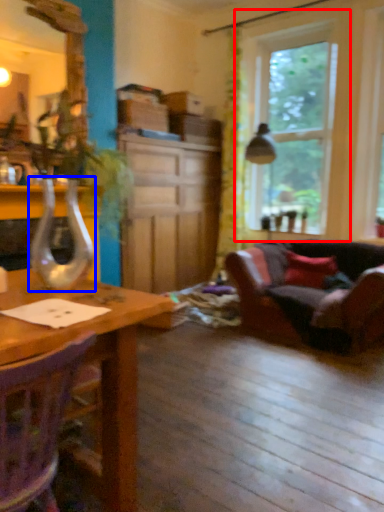
Question: Which of the following is the closest to the observer, window (highlighted by a red box) or glass vase (highlighted by a blue box)?

Choices:
 (A) window
 (B) glass vase

Answer: (B)